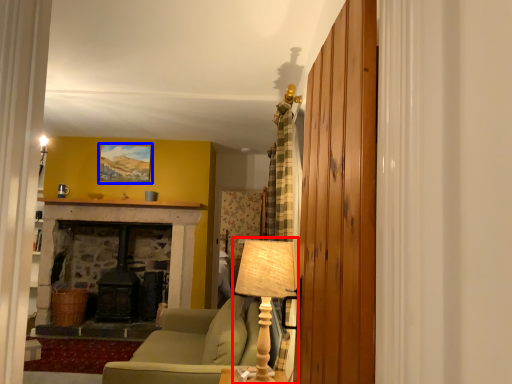
Question: Among these objects, which one is nearest to the camera, table lamp (highlighted by a red box) or picture frame (highlighted by a blue box)?

Choices:
 (A) table lamp
 (B) picture frame

Answer: (A)